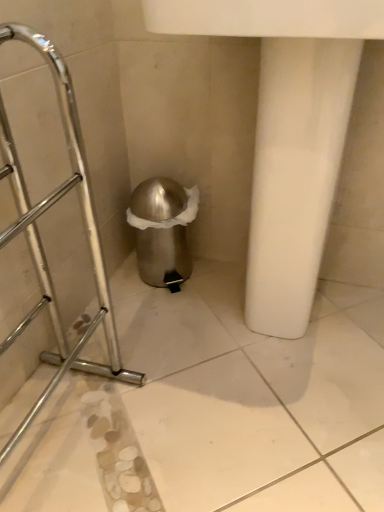
Question: Should I look upward or downward to see polished metallic trash can at center?

Choices:
 (A) up
 (B) down

Answer: (A)